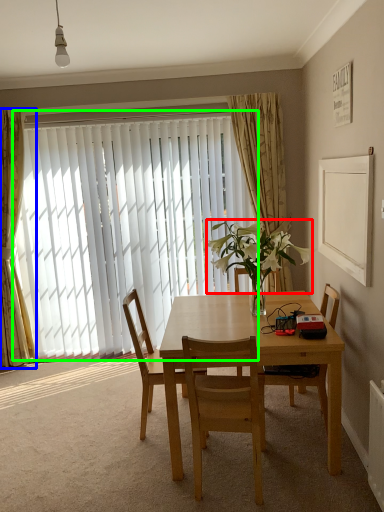
Question: Which object is the farthest from flower (highlighted by a red box)? Choose among these: curtain (highlighted by a blue box) or window (highlighted by a green box).

Choices:
 (A) curtain
 (B) window

Answer: (A)